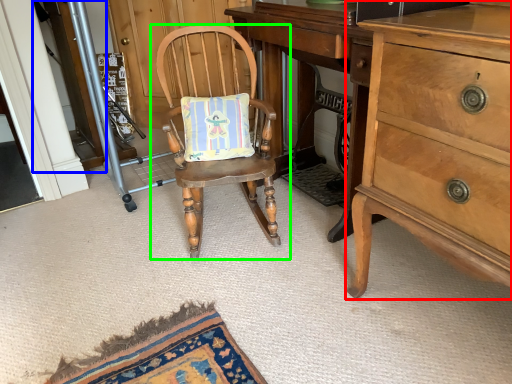
Question: Which object is the closest to the cabinetry (highlighted by a red box)? Choose among these: screen door (highlighted by a blue box) or chair (highlighted by a green box).

Choices:
 (A) screen door
 (B) chair

Answer: (B)